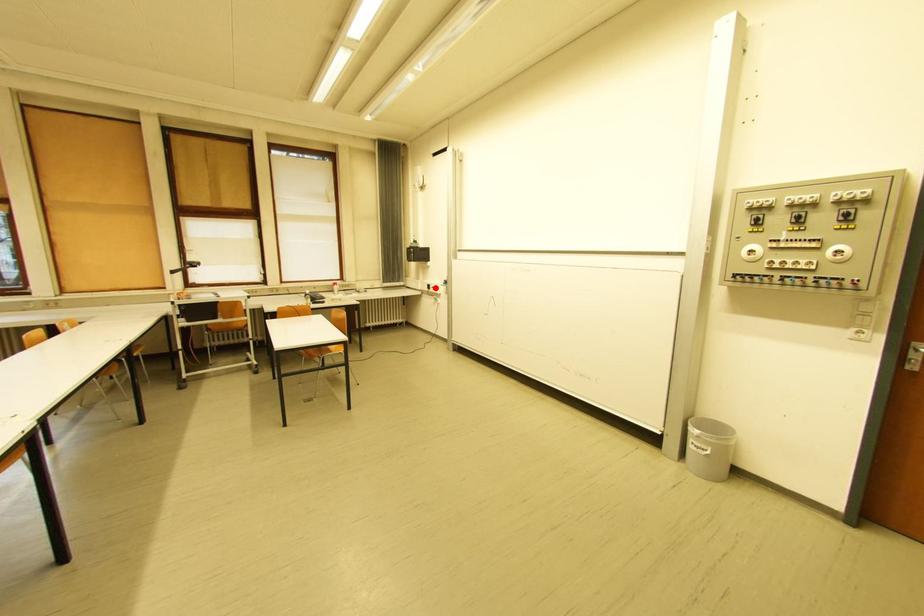
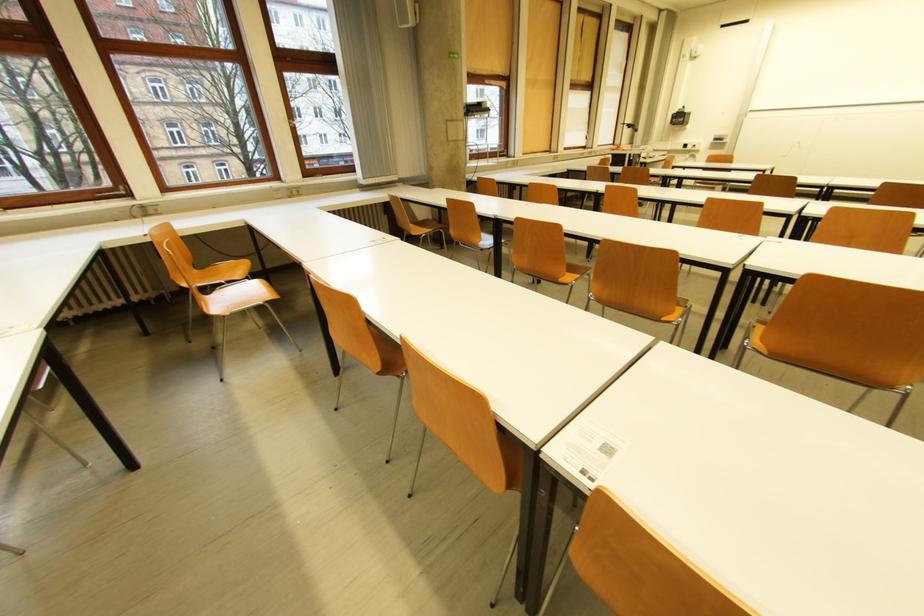
Where in the second image is the point corresponding to the highlighted location from the first image?

(691, 147)